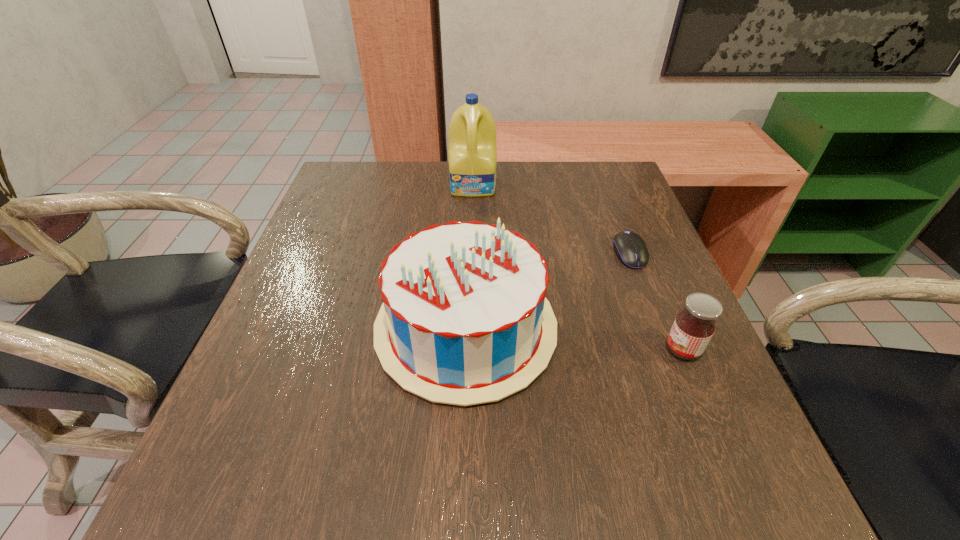
I want to click on free spot between the second tallest object and the computer mouse, so click(x=547, y=291).

This screenshot has height=540, width=960. Identify the location of vacant area that lies between the jam and the second tallest object. (574, 339).

Locate an element on the screen. The height and width of the screenshot is (540, 960). unoccupied area between the jam and the tallest object is located at coordinates (578, 267).

The height and width of the screenshot is (540, 960). What are the coordinates of `vacant point located between the jam and the shortest object` in the screenshot? It's located at (656, 302).

The image size is (960, 540). Identify the location of vacant area between the computer mouse and the farthest object. (552, 220).

At what (x,y) coordinates should I click in order to perform the action: click on free space between the second shortest object and the farthest object. Please return your answer as a coordinate pair (x, y). This screenshot has width=960, height=540. Looking at the image, I should click on (578, 267).

Find the location of a particular element. The height and width of the screenshot is (540, 960). free spot between the second shortest object and the computer mouse is located at coordinates (656, 302).

Where is `object that is the third closest to the computer mouse`? Image resolution: width=960 pixels, height=540 pixels. object that is the third closest to the computer mouse is located at coordinates [x=472, y=152].

Locate an element on the screen. This screenshot has height=540, width=960. object that can be found as the third closest to the detergent is located at coordinates (694, 326).

Locate an element on the screen. vacant area in the image that satisfies the following two spatial constraints: 1. on the label of the detergent; 2. on the right side of the computer mouse is located at coordinates (472, 254).